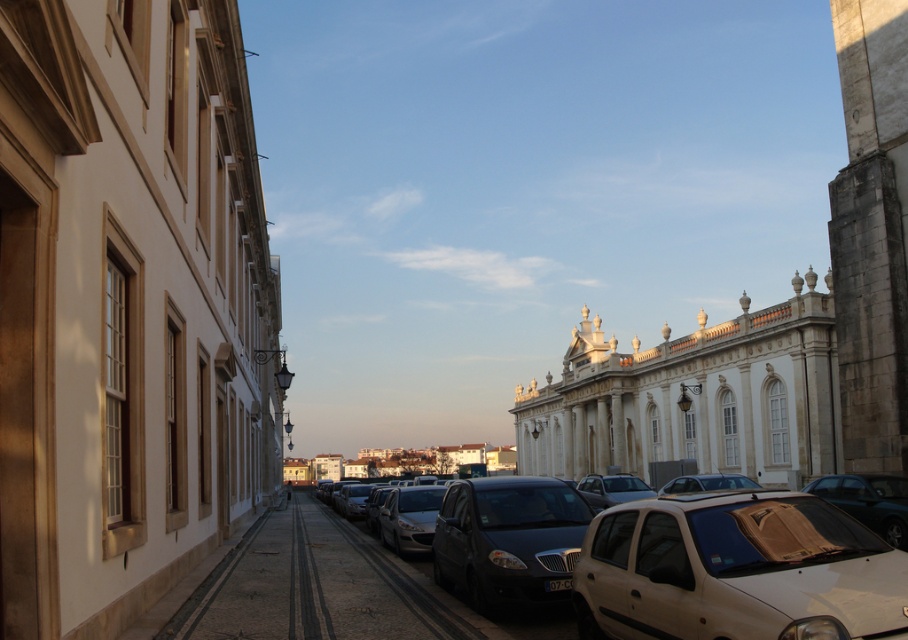
You are a delivery person who needs to park your 2.5 meters tall delivery van. You see the black asphalt at center and the shiny black sedan at center in the image. Which area can accommodate your van based on height?

The black asphalt at center is taller than the shiny black sedan at center, so the black asphalt at center can accommodate the delivery van as it has sufficient height clearance.

You are standing on the cobblestone street on the left side of the image. You want to walk to the point marked at coordinates point (318, 588). Will you need to step onto asphalt to reach it?

The point (318, 588) is on black asphalt at center, so yes, you will need to step onto asphalt to reach it since the cobblestone street is on the left side and the asphalt is at the center.